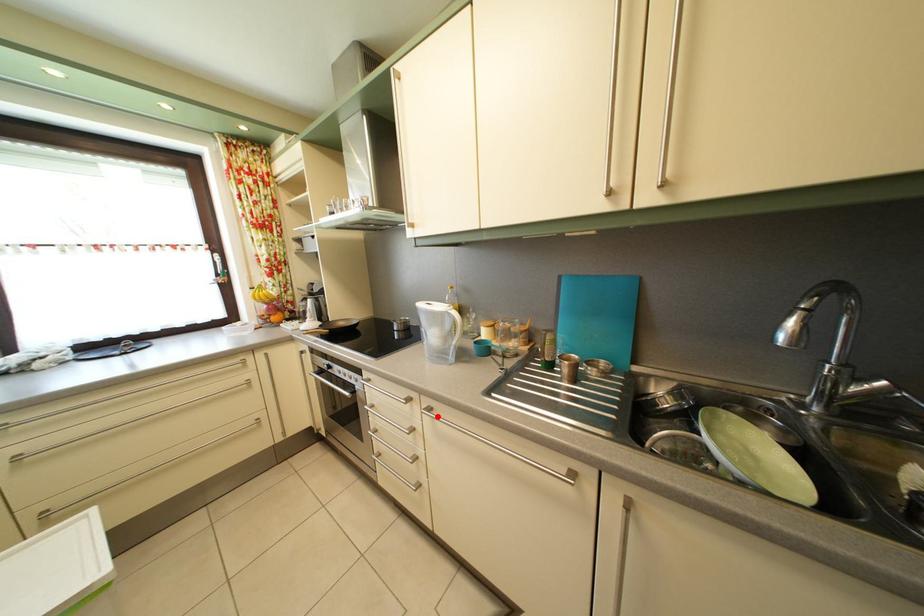
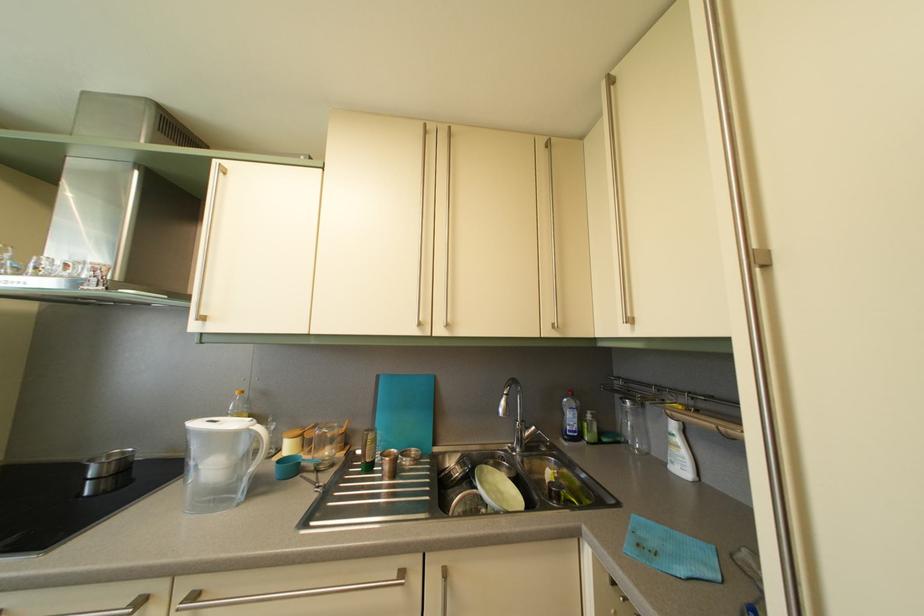
Question: I am providing you with two images of the same scene from different viewpoints. In image1, a red point is highlighted. Considering the same 3D point in image2, which of the following is correct?

Choices:
 (A) It is closer
 (B) It is farther

Answer: (A)